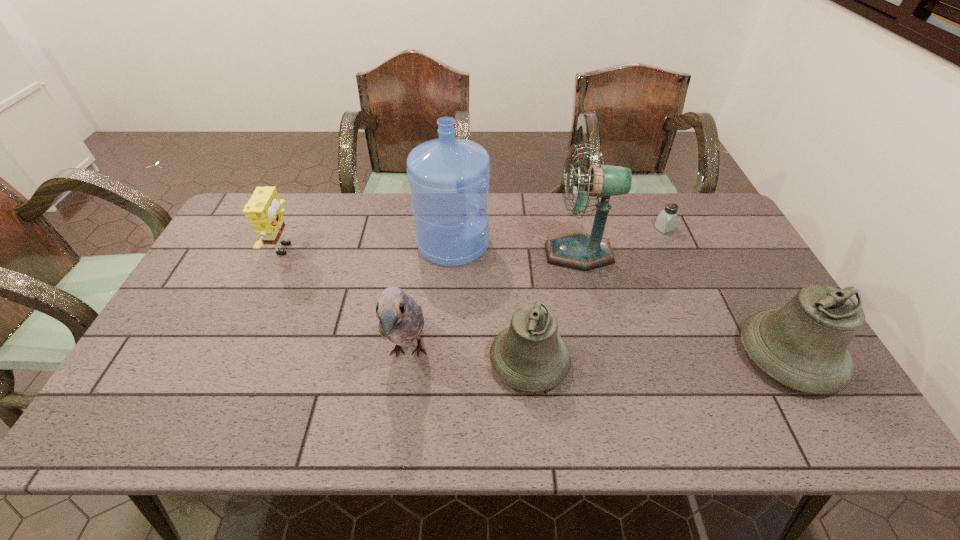
Identify which object is the second nearest to the saltshaker. Please provide its 2D coordinates. Your answer should be formatted as a tuple, i.e. [(x, y)], where the tuple contains the x and y coordinates of a point satisfying the conditions above.

[(803, 345)]

This screenshot has width=960, height=540. Identify the location of vacant space that satisfies the following two spatial constraints: 1. on the side of the left bell with the handle; 2. on the right side of the water jug. (445, 361).

Where is `free spot that satisfies the following two spatial constraints: 1. on the back side of the left bell; 2. on the side of the water jug with the handle`? free spot that satisfies the following two spatial constraints: 1. on the back side of the left bell; 2. on the side of the water jug with the handle is located at coordinates (518, 244).

Image resolution: width=960 pixels, height=540 pixels. Identify the location of vacant region that satisfies the following two spatial constraints: 1. on the front-facing side of the leftmost object; 2. on the right side of the shorter bell. (235, 361).

This screenshot has height=540, width=960. In order to click on vacant space that satisfies the following two spatial constraints: 1. in front of the fan where the wind blows; 2. on the right side of the right bell in this screenshot , I will do `click(602, 356)`.